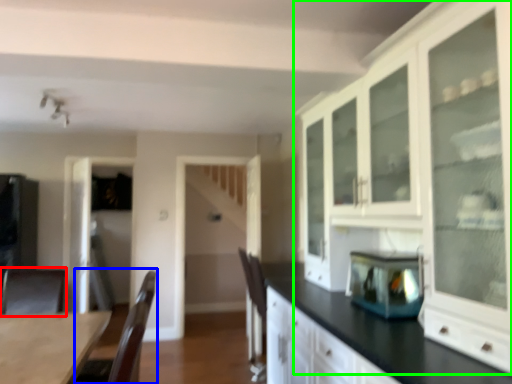
Question: Which is nearer to the armchair (highlighted by a red box)? armchair (highlighted by a blue box) or cabinetry (highlighted by a green box).

Choices:
 (A) armchair
 (B) cabinetry

Answer: (A)